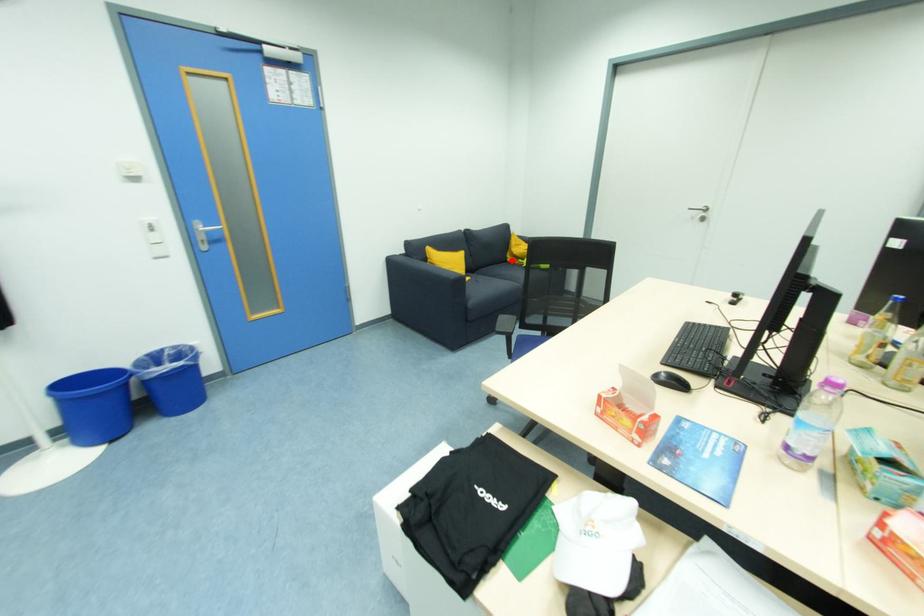
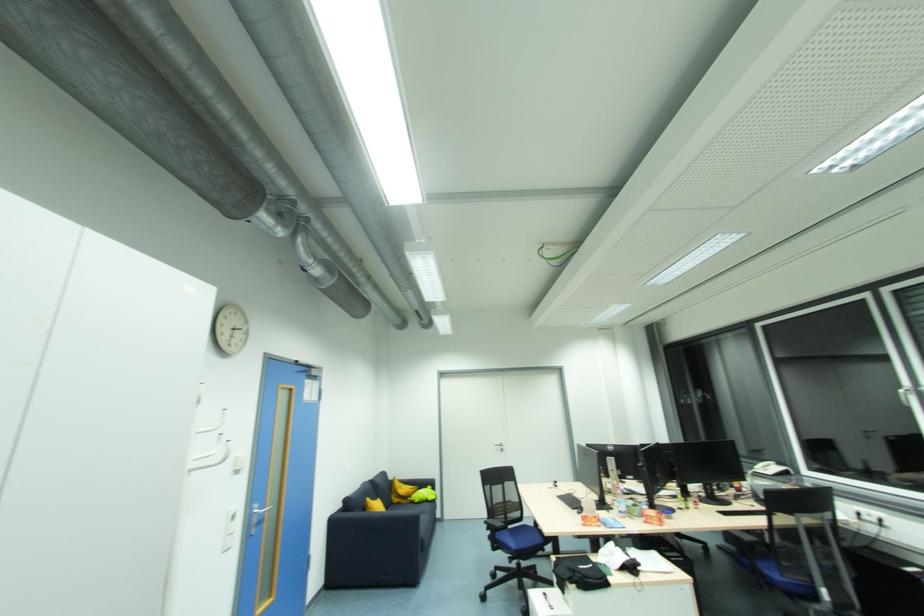
Question: I am providing you with two images of the same scene from different viewpoints. A red point is shown in image1. For the corresponding object point in image2, is it positioned nearer or farther from the camera?

Choices:
 (A) Nearer
 (B) Farther

Answer: (B)